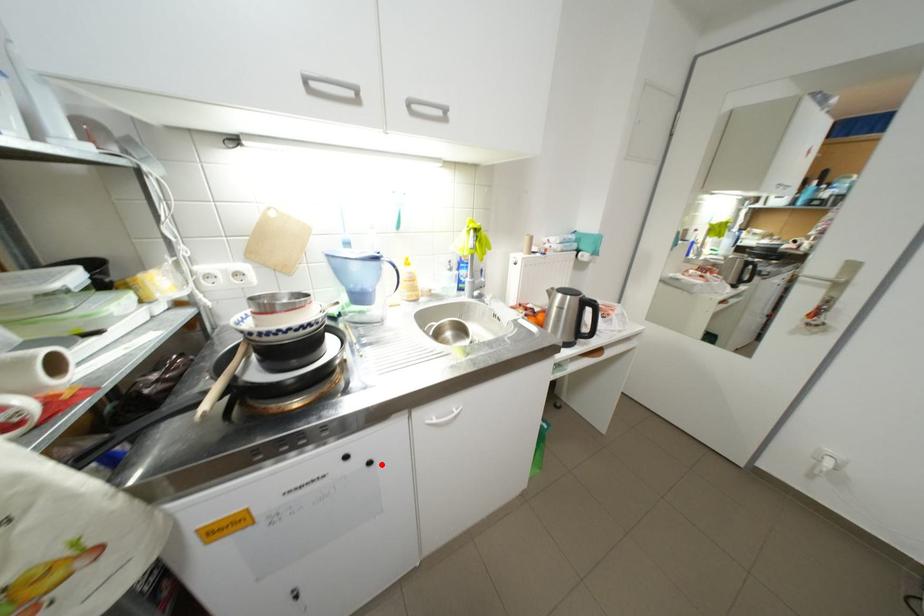
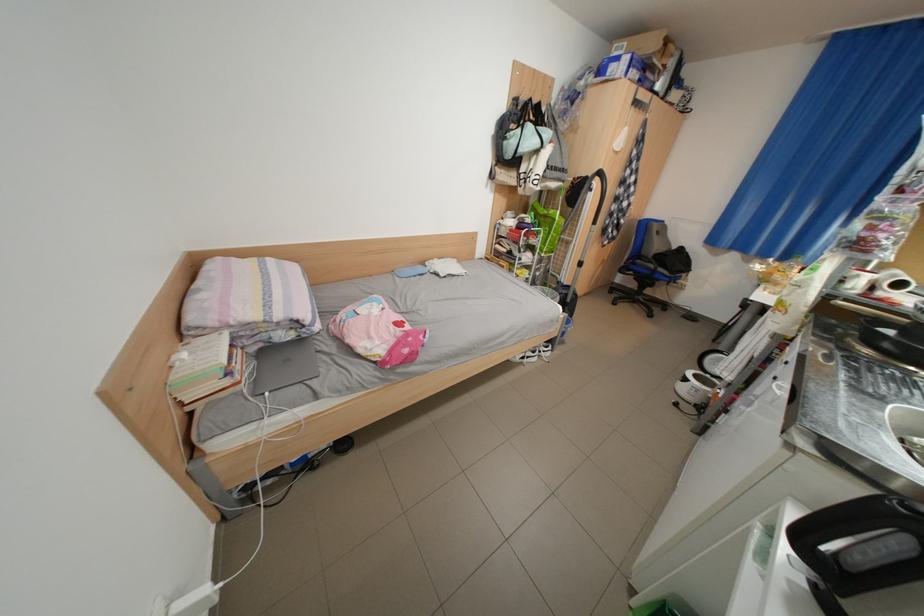
Question: I am providing you with two images of the same scene from different viewpoints. Given a red point in image1, look at the same physical point in image2. Is it:

Choices:
 (A) Closer to the viewpoint
 (B) Farther from the viewpoint

Answer: (B)